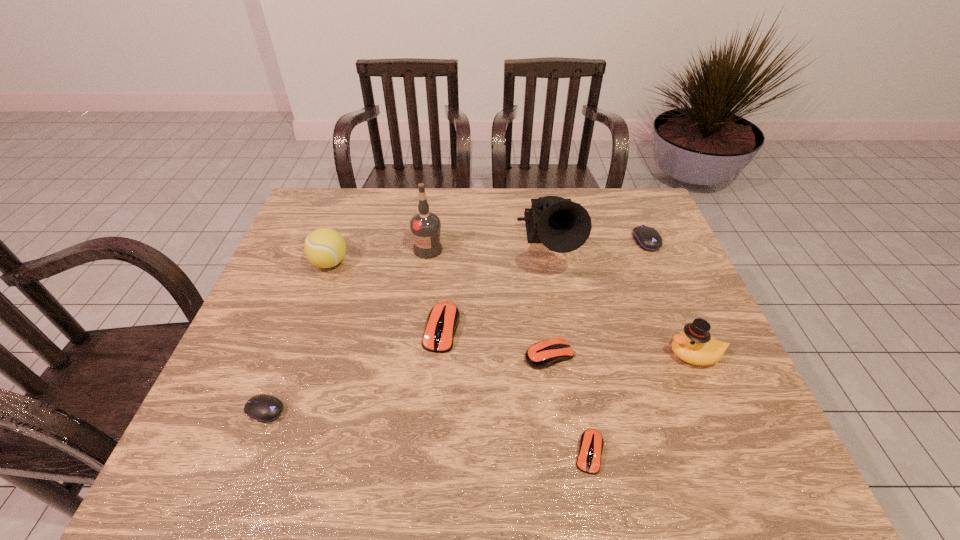
Locate an element on the screen. The height and width of the screenshot is (540, 960). the nearer black computer mouse is located at coordinates (264, 408).

You are a GUI agent. You are given a task and a screenshot of the screen. Output one action in this format:
    pyautogui.click(x=<x>, y=<y>)
    Task: Click on the nearest orange computer mouse
    
    Given the screenshot: What is the action you would take?
    pyautogui.click(x=591, y=442)

At what (x,y) coordinates should I click in order to perform the action: click on the shortest computer mouse. Please return your answer as a coordinate pair (x, y). This screenshot has width=960, height=540. Looking at the image, I should click on (591, 442).

Locate an element on the screen. Image resolution: width=960 pixels, height=540 pixels. vacant space located 0.360m from the horn of the black phonograph_record is located at coordinates (577, 401).

Where is `free space located 0.160m on the front label of the vodka`? free space located 0.160m on the front label of the vodka is located at coordinates (421, 299).

Image resolution: width=960 pixels, height=540 pixels. I want to click on vacant space located 0.360m on the front of the tennis ball, so click(x=285, y=388).

What are the coordinates of `vacant point located on the front-facing side of the duck` in the screenshot? It's located at (579, 355).

The height and width of the screenshot is (540, 960). Find the location of `vacant space situated 0.200m on the front-facing side of the duck`. vacant space situated 0.200m on the front-facing side of the duck is located at coordinates [x=583, y=355].

Where is `vacant space located on the front-facing side of the duck`? Image resolution: width=960 pixels, height=540 pixels. vacant space located on the front-facing side of the duck is located at coordinates (533, 355).

Locate an element on the screen. vacant space located on the right of the biggest orange computer mouse is located at coordinates (539, 329).